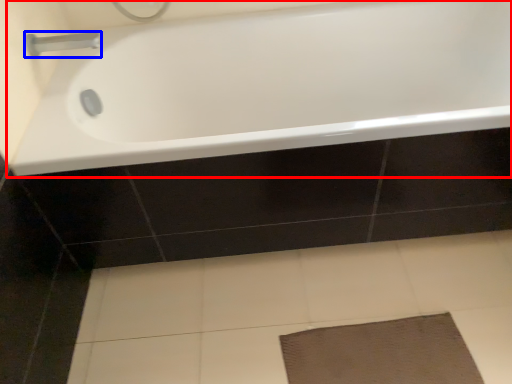
Question: Which of the following is the farthest to the observer, bathtub (highlighted by a red box) or tap (highlighted by a blue box)?

Choices:
 (A) bathtub
 (B) tap

Answer: (B)